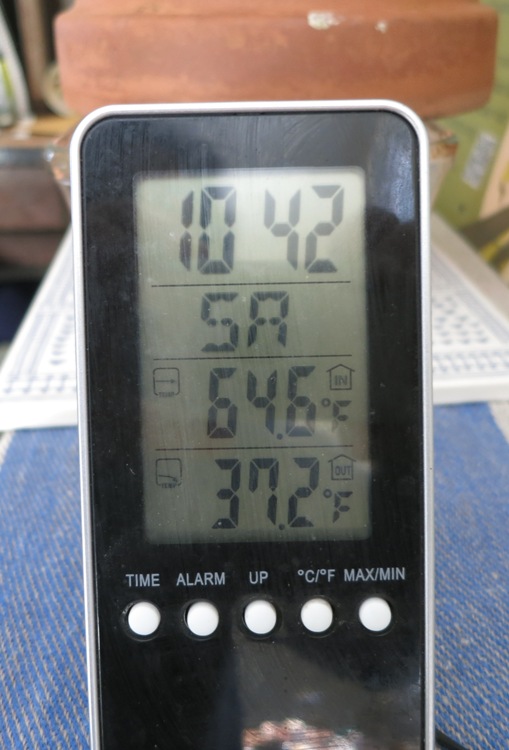
The height and width of the screenshot is (750, 509). What are the coordinates of `wooden shelf` in the screenshot? It's located at (42, 206), (41, 244).